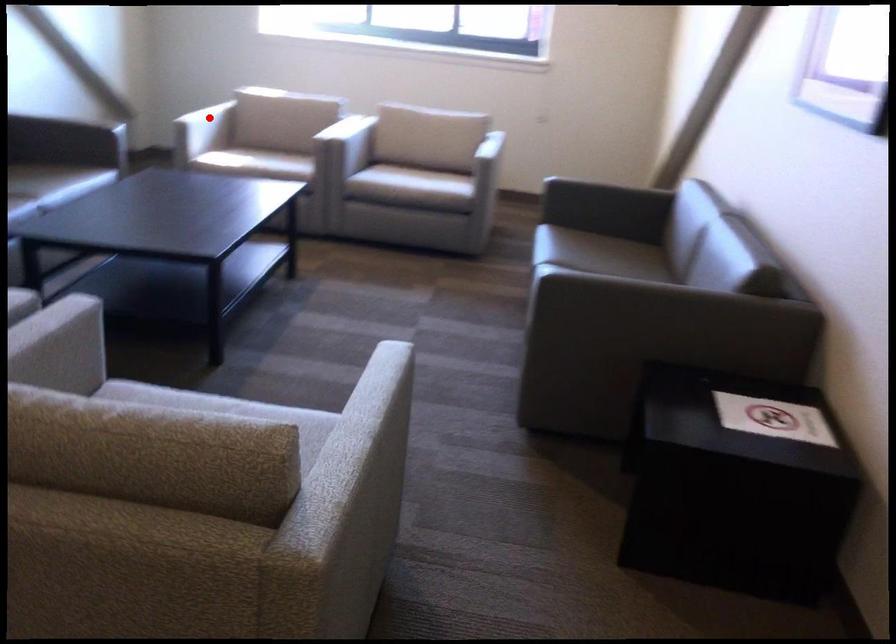
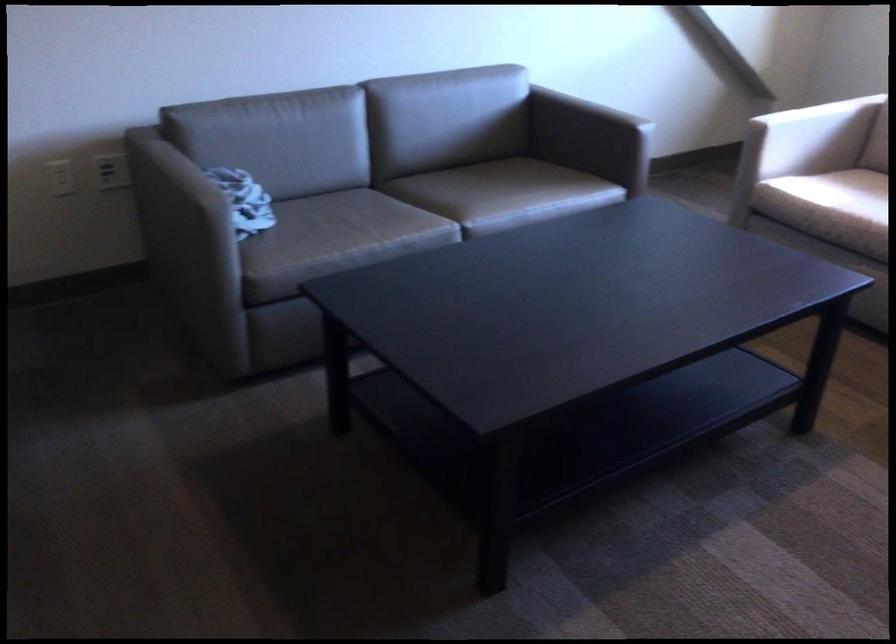
Question: I am providing you with two images of the same scene from different viewpoints. Image1 has a red point marked. In image2, the corresponding 3D location appears at what relative position? Reply with the corresponding letter.

Choices:
 (A) Closer
 (B) Farther

Answer: (A)